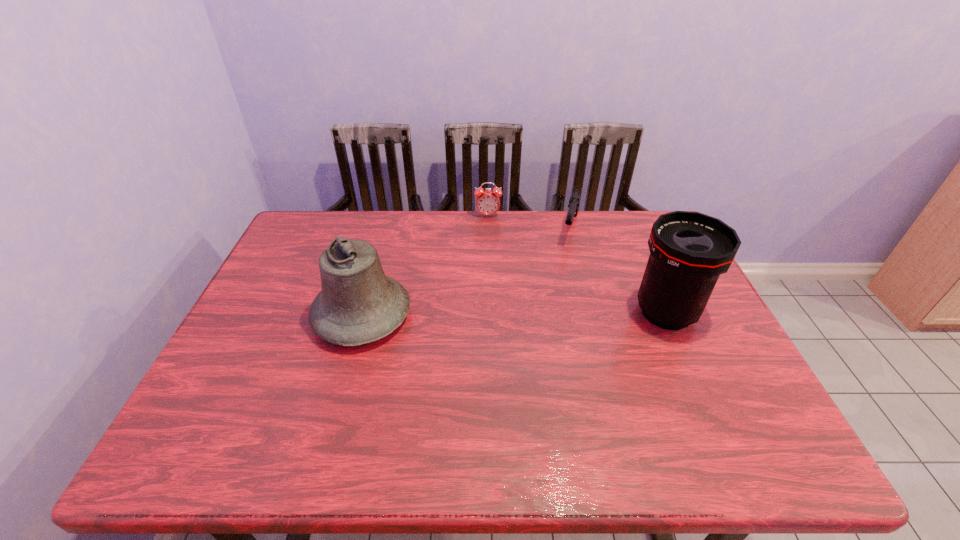
In order to click on blank area at the near right corner in this screenshot , I will do `click(768, 408)`.

You are a GUI agent. You are given a task and a screenshot of the screen. Output one action in this format:
    pyautogui.click(x=<x>, y=<y>)
    Task: Click on the free area in between the gun and the leftmost object
    This screenshot has height=540, width=960.
    Given the screenshot: What is the action you would take?
    pyautogui.click(x=466, y=272)

The height and width of the screenshot is (540, 960). What are the coordinates of `free spot between the second object from right to left and the second object from left to right` in the screenshot? It's located at (529, 222).

The image size is (960, 540). Identify the location of empty location between the alarm clock and the second object from right to left. (529, 222).

I want to click on free space that is in between the leftmost object and the telephoto lens, so click(x=515, y=314).

Identify the location of vacant space that's between the second object from left to right and the leftmost object. The image size is (960, 540). (425, 266).

Locate an element on the screen. The height and width of the screenshot is (540, 960). free space between the alarm clock and the leftmost object is located at coordinates (425, 266).

Identify the location of free spot between the rightmost object and the second object from right to left. (618, 271).

Where is `vacant space that's between the rightmost object and the bell`? The width and height of the screenshot is (960, 540). vacant space that's between the rightmost object and the bell is located at coordinates (515, 314).

Where is `free space between the gun and the bell`? The image size is (960, 540). free space between the gun and the bell is located at coordinates (466, 272).